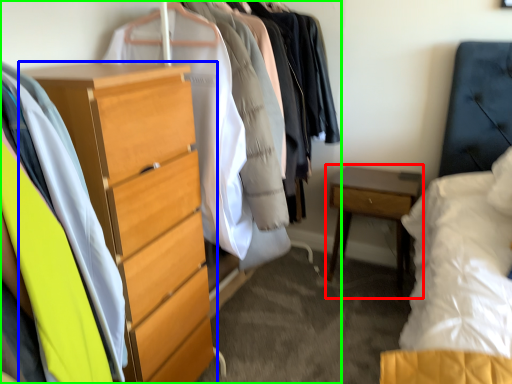
Question: Which is nearer to the nightstand (highlighted by a red box)? chest of drawers (highlighted by a blue box) or closet (highlighted by a green box).

Choices:
 (A) chest of drawers
 (B) closet

Answer: (A)